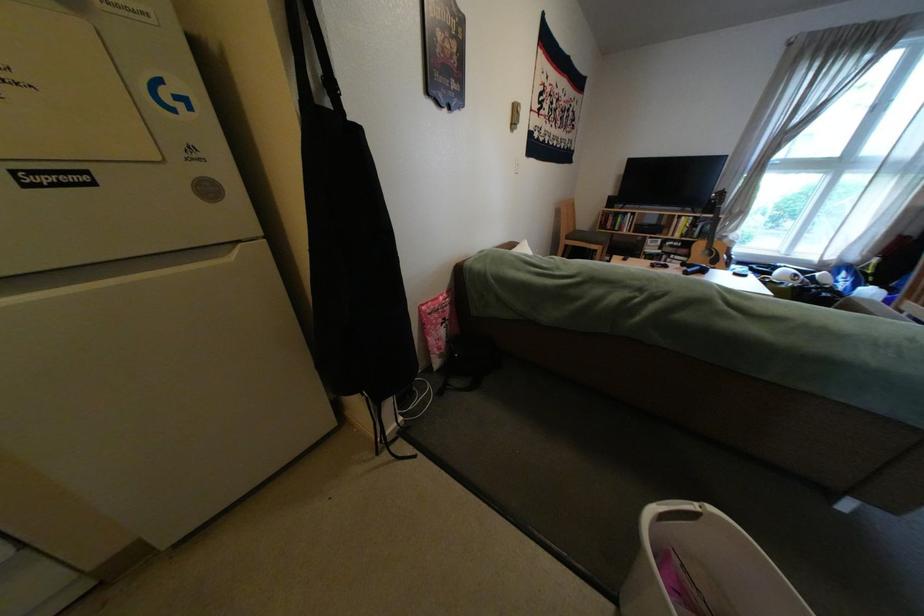
Where would you lift the pink food bag? Please return your answer as a coordinate pair (x, y).

(438, 325)